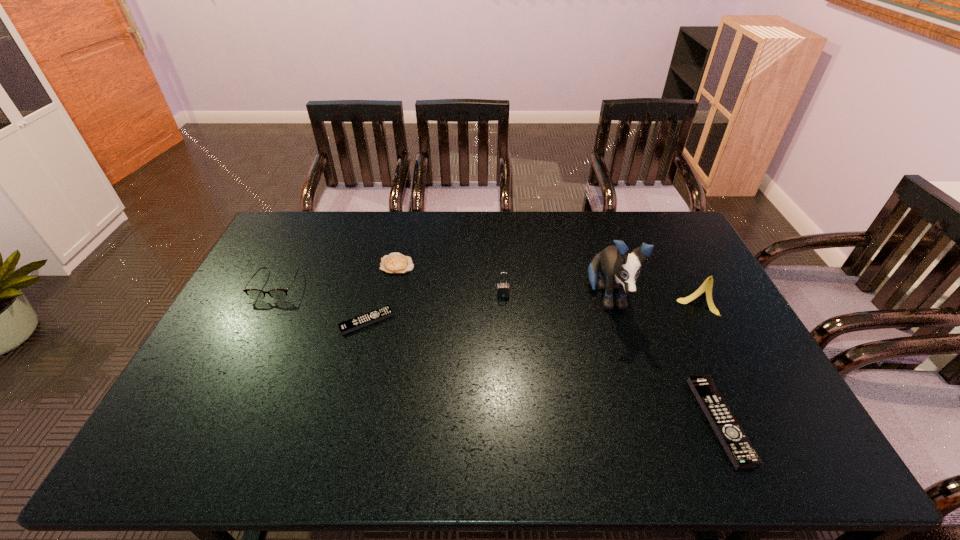
I want to click on vacant point located between the quiche and the puppy, so click(502, 282).

Image resolution: width=960 pixels, height=540 pixels. I want to click on free space between the shorter remote control and the quiche, so click(382, 293).

Where is `free spot between the padlock and the banana`? The height and width of the screenshot is (540, 960). free spot between the padlock and the banana is located at coordinates (600, 297).

You are a GUI agent. You are given a task and a screenshot of the screen. Output one action in this format:
    pyautogui.click(x=<x>, y=<y>)
    Task: Click on the vacant space that is in between the fourth shortest object and the second tallest object
    This screenshot has height=540, width=960.
    Given the screenshot: What is the action you would take?
    pyautogui.click(x=487, y=292)

You are a GUI agent. You are given a task and a screenshot of the screen. Output one action in this format:
    pyautogui.click(x=<x>, y=<y>)
    Task: Click on the blank region between the nearest object and the left remote control
    
    Given the screenshot: What is the action you would take?
    point(543,371)

Identify the location of empty location between the fifth shortest object and the banana. click(600, 297).

Image resolution: width=960 pixels, height=540 pixels. What are the coordinates of `free area in between the leftmost object and the right remote control` in the screenshot? It's located at (498, 353).

This screenshot has height=540, width=960. In order to click on vacant space that's between the right remote control and the leftmost object in this screenshot , I will do `click(498, 353)`.

This screenshot has width=960, height=540. Find the location of `free space between the third shortest object and the banana`. free space between the third shortest object and the banana is located at coordinates (708, 360).

Image resolution: width=960 pixels, height=540 pixels. In order to click on object that stands as the fifth closest to the quiche in this screenshot , I will do `click(707, 285)`.